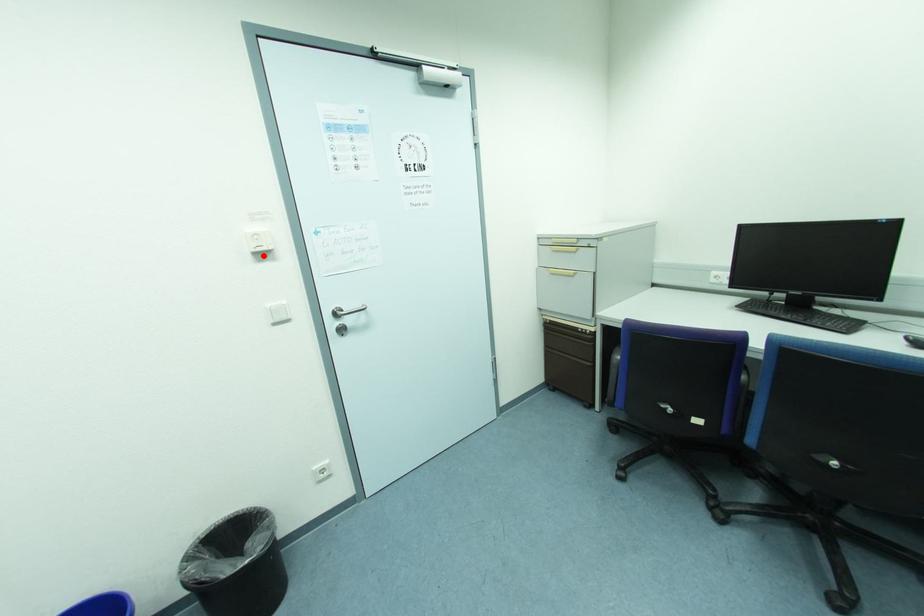
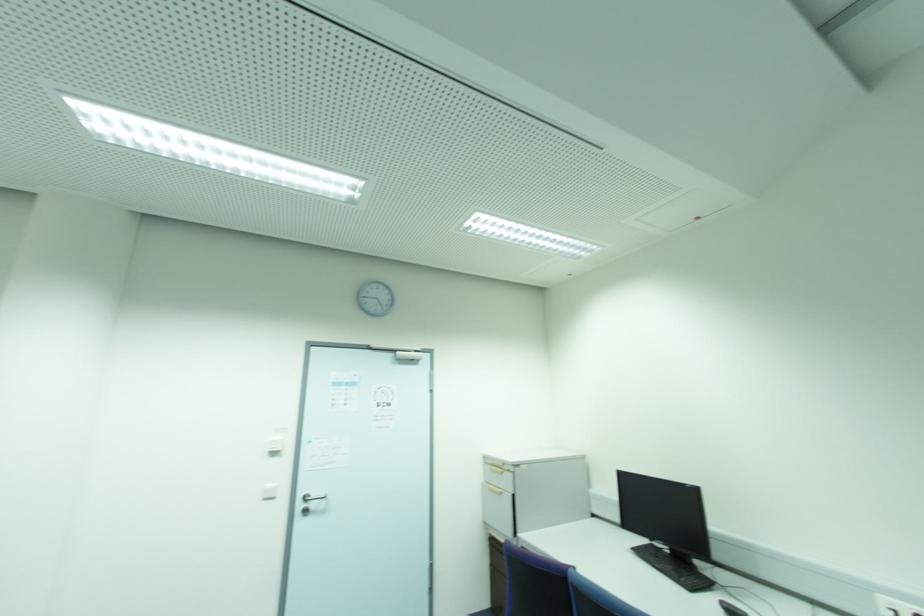
Find the pixel in the second image that matches the highlighted location in the first image.

(274, 454)